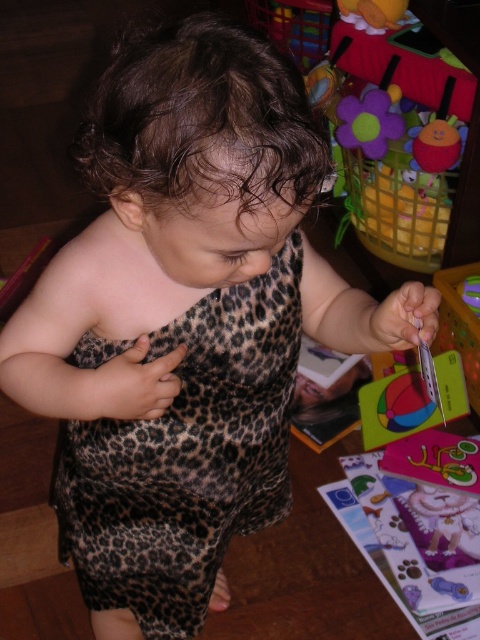
Question: Does leopard print fabric dress at center have a smaller size compared to fluffy fabric flower at upper right?

Choices:
 (A) no
 (B) yes

Answer: (B)

Question: Does leopard print fabric dress at center appear over fluffy fabric flower at upper right?

Choices:
 (A) no
 (B) yes

Answer: (A)

Question: Is leopard print fabric dress at center to the right of fluffy fabric flower at upper right from the viewer's perspective?

Choices:
 (A) yes
 (B) no

Answer: (B)

Question: Which object is farther from the camera taking this photo?

Choices:
 (A) leopard print fabric dress at center
 (B) fluffy fabric flower at upper right

Answer: (B)

Question: Which point is farther to the camera?

Choices:
 (A) (404, 35)
 (B) (154, 512)

Answer: (A)